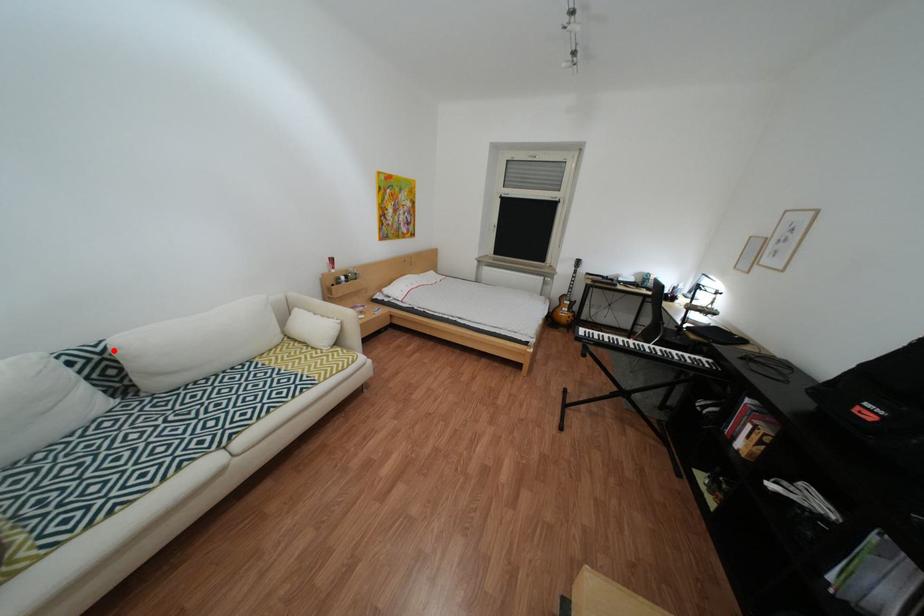
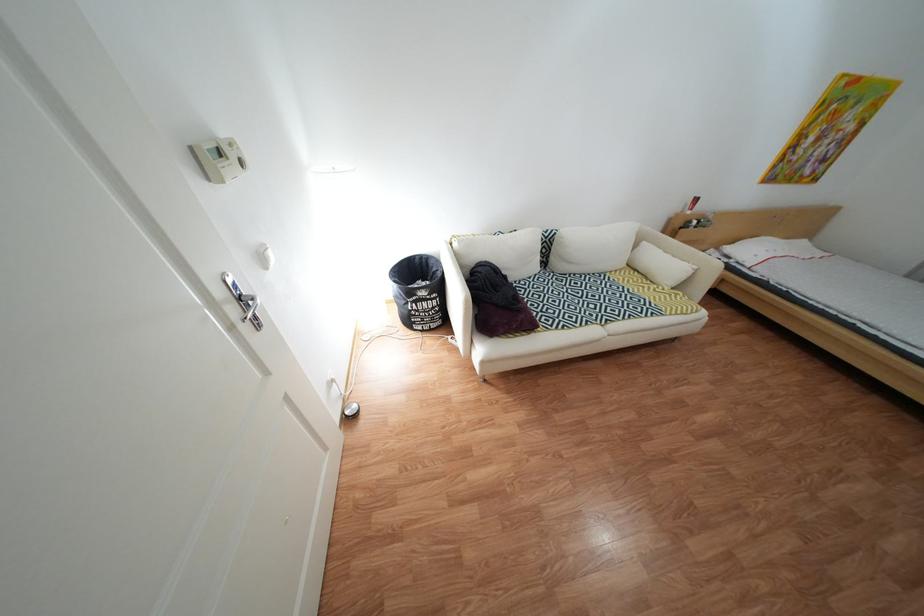
Question: I am providing you with two images of the same scene from different viewpoints. Given a red point in image1, look at the same physical point in image2. Is it:

Choices:
 (A) Closer to the viewpoint
 (B) Farther from the viewpoint

Answer: (A)